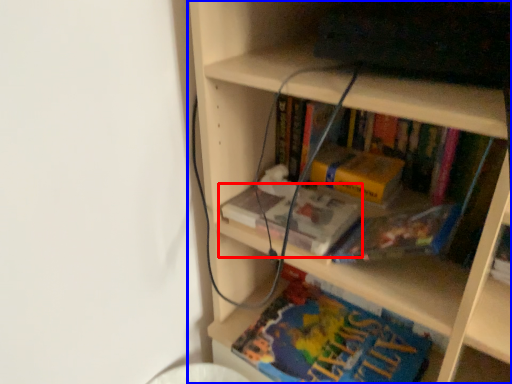
Question: Which of the following is the closest to the observer, book (highlighted by a red box) or bookcase (highlighted by a blue box)?

Choices:
 (A) book
 (B) bookcase

Answer: (B)